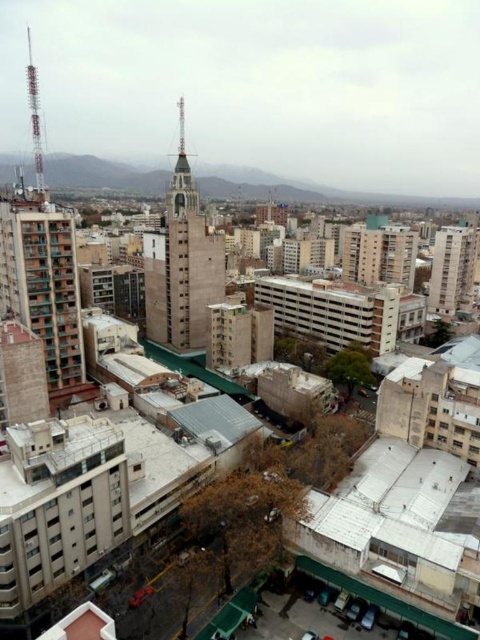
Where is `green concrete building at left`? This screenshot has width=480, height=640. green concrete building at left is located at coordinates (44, 289).

Between green concrete building at left and concrete tower at center, which one is positioned lower?

green concrete building at left is lower down.

Is point (64, 326) positioned in front of point (153, 248)?

Yes.

Find the location of a particular element. This screenshot has height=640, width=480. green concrete building at left is located at coordinates (44, 289).

Image resolution: width=480 pixels, height=640 pixels. What do you see at coordinates (44, 289) in the screenshot?
I see `green concrete building at left` at bounding box center [44, 289].

Which is below, green concrete building at left or smooth concrete building at upper right?

green concrete building at left

Which is behind, point (69, 339) or point (478, 236)?

Point (478, 236)

The image size is (480, 640). I want to click on green concrete building at left, so click(x=44, y=289).

Is point (207, 252) positioned after point (444, 234)?

No, it is not.

Is concrete tower at center positioned behind smooth concrete building at upper right?

No, concrete tower at center is in front of smooth concrete building at upper right.

Identify the location of concrete tower at center. This screenshot has height=640, width=480. (181, 262).

Identify the location of concrete tower at center. The image size is (480, 640). (181, 262).